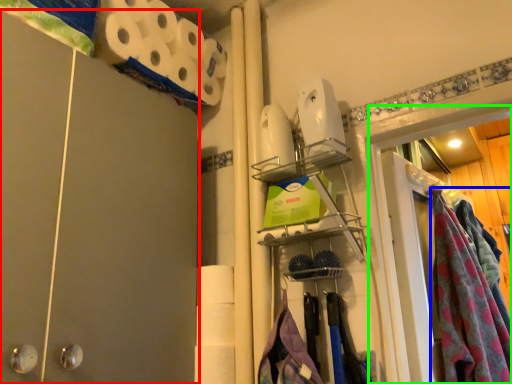
Question: Which object is the closest to the barn door (highlighted by a red box)? Choose among these: clothing (highlighted by a blue box) or glass door (highlighted by a green box).

Choices:
 (A) clothing
 (B) glass door

Answer: (B)